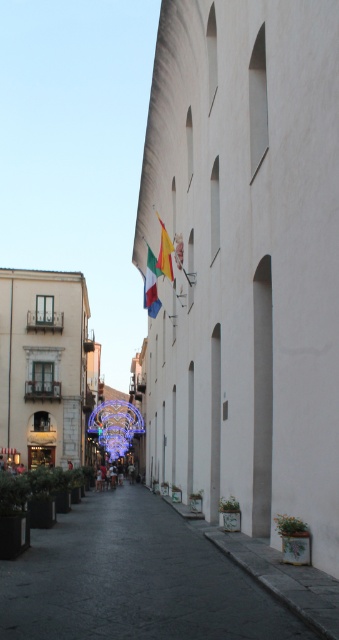
Question: Which of the following is the closest to the observer?

Choices:
 (A) white fabric flag at center
 (B) dark gray asphalt at center

Answer: (B)

Question: Observing the image, what is the correct spatial positioning of white fabric flag at center in reference to green leafy plant at lower right?

Choices:
 (A) above
 (B) below

Answer: (A)

Question: Does dark gray asphalt at center appear over green matte planter at lower center?

Choices:
 (A) no
 (B) yes

Answer: (A)

Question: Can you confirm if green matte planter at lower left is thinner than green matte planter at lower center?

Choices:
 (A) yes
 (B) no

Answer: (B)

Question: Which point appears farthest from the camera in this image?

Choices:
 (A) (221, 509)
 (B) (146, 627)
 (C) (151, 298)

Answer: (C)

Question: Which point is farther from the camera taking this photo?

Choices:
 (A) (98, 588)
 (B) (161, 250)

Answer: (B)